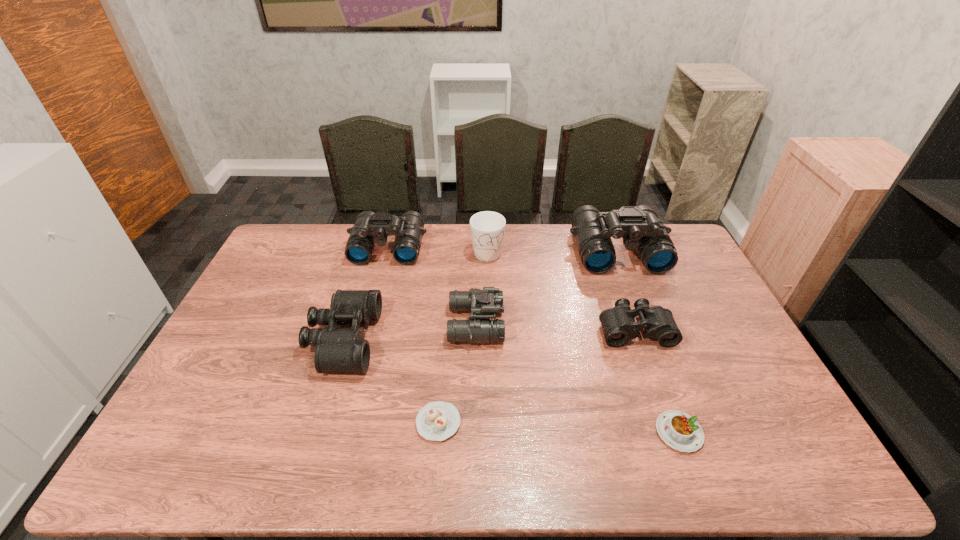
Locate an element on the screen. The height and width of the screenshot is (540, 960). the seventh closest object to the left black binoculars is located at coordinates (677, 429).

Identify the location of binoculars identified as the closest to the cupcake. (337, 349).

Select which binoculars appears as the fourth closest to the left black binoculars. Please provide its 2D coordinates. Your answer should be formatted as a tuple, i.e. [(x, y)], where the tuple contains the x and y coordinates of a point satisfying the conditions above.

[(618, 323)]

Locate an element on the screen. blue binoculars that is the second closest one to the bigger black binoculars is located at coordinates (484, 303).

At what (x,y) coordinates should I click in order to perform the action: click on the third closest blue binoculars relative to the left black binoculars. Please return your answer as a coordinate pair (x, y). The height and width of the screenshot is (540, 960). Looking at the image, I should click on (641, 229).

Where is `free space that satisfies the following two spatial constraints: 1. on the side of the mug with the handle; 2. through the lenses of the nearest blue binoculars`? The width and height of the screenshot is (960, 540). free space that satisfies the following two spatial constraints: 1. on the side of the mug with the handle; 2. through the lenses of the nearest blue binoculars is located at coordinates (489, 324).

Find the location of `vacant area in the image that satisfies the following two spatial constraints: 1. through the lenses of the pudding; 2. on the left side of the nearest blue binoculars`. vacant area in the image that satisfies the following two spatial constraints: 1. through the lenses of the pudding; 2. on the left side of the nearest blue binoculars is located at coordinates (475, 433).

Where is `free region that satisfies the following two spatial constraints: 1. through the lenses of the cupcake; 2. on the left side of the leftmost blue binoculars`? free region that satisfies the following two spatial constraints: 1. through the lenses of the cupcake; 2. on the left side of the leftmost blue binoculars is located at coordinates (343, 422).

The width and height of the screenshot is (960, 540). In order to click on blank space that satisfies the following two spatial constraints: 1. through the lenses of the biggest blue binoculars; 2. through the lenses of the third binoculars from left to right in this screenshot , I will do `click(646, 324)`.

Locate an element on the screen. Image resolution: width=960 pixels, height=540 pixels. vacant position in the image that satisfies the following two spatial constraints: 1. on the side of the mug with the handle; 2. at the eyepieces of the left black binoculars is located at coordinates (489, 339).